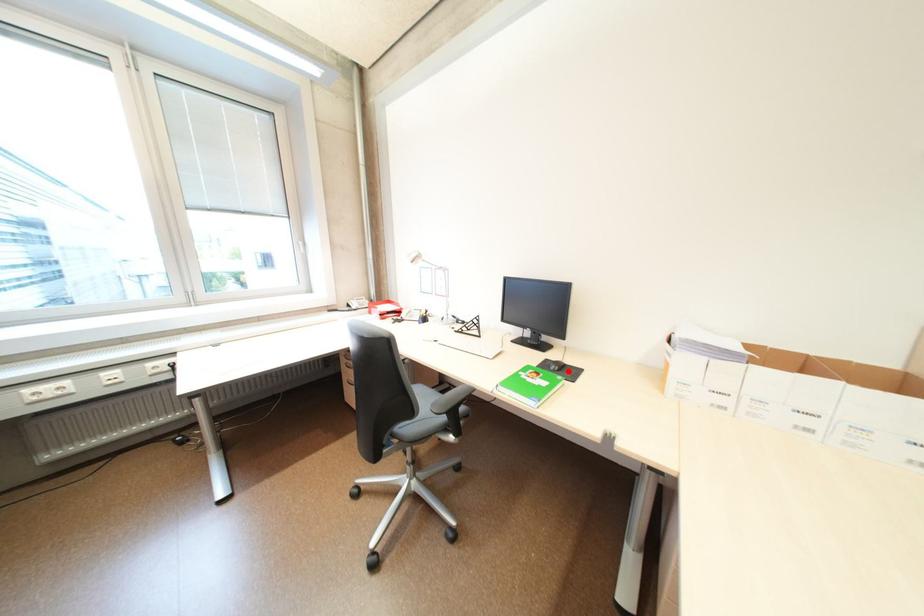
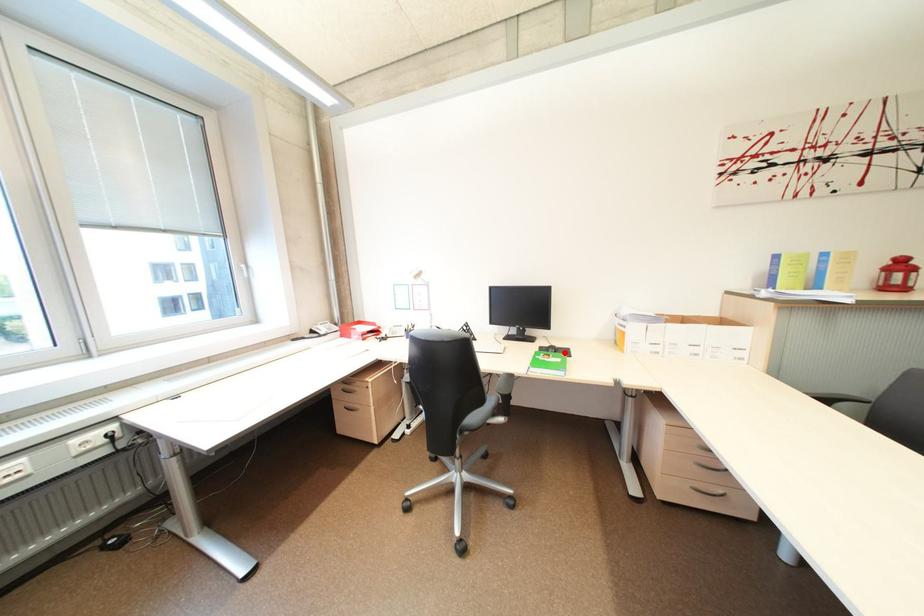
I am providing you with two images of the same scene from different viewpoints. A red point is marked on the first image and another point is marked on the second image. Are the points marked in image1 and image2 representing the same 3D position?

Yes